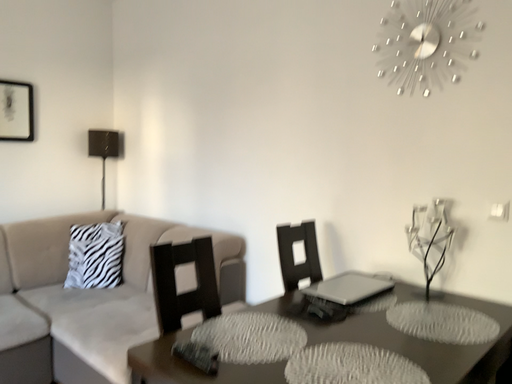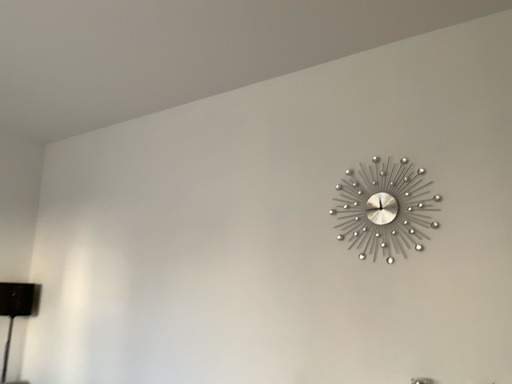
Question: Which way did the camera rotate in the video?

Choices:
 (A) rotated left
 (B) rotated right

Answer: (B)